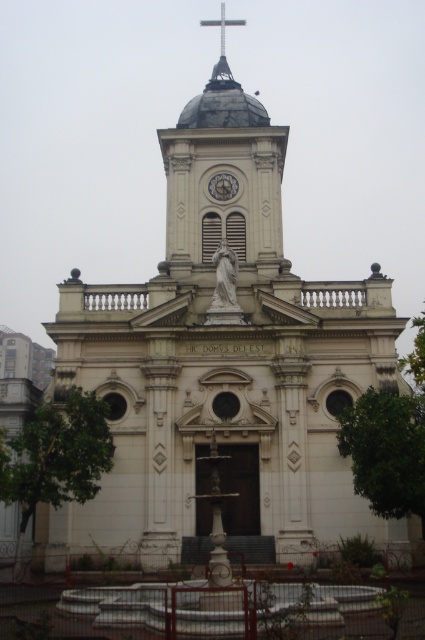
You are a maintenance worker needing to replace a part for the metallic clock at center and the metallic cross at upper center. You have a tool that can only fit through a narrow opening. Which object requires a thicker tool to work on?

→ The metallic cross at upper center requires a thicker tool because it is thicker than the metallic clock at center.

You are standing in front of the church and want to take a photo of the metallic cross at upper center without the metallic clock at center blocking it. How should you adjust your position?

The metallic clock at center is in front of the metallic cross at upper center, so you should move to a position where the metallic clock at center is no longer between you and the metallic cross at upper center. This could involve moving to the side or adjusting your angle to ensure the cross is visible without obstruction.

You are standing in front of the classical church and notice two points marked on the facade. The first point is at coordinate point [215,188] and the second is at point [215,19]. Which point is closer to you?

Point [215,188] is closer to the viewer than point [215,19].